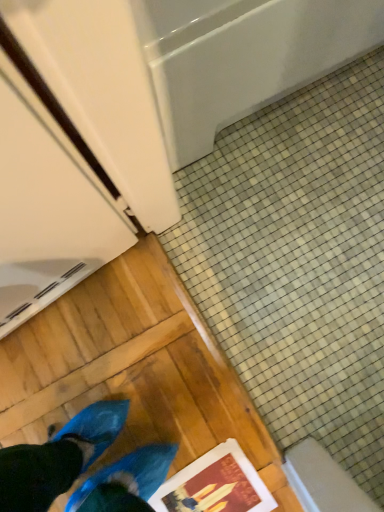
The width and height of the screenshot is (384, 512). In order to click on white glossy bathtub at upper center in this screenshot , I will do `click(242, 57)`.

The width and height of the screenshot is (384, 512). What do you see at coordinates (242, 57) in the screenshot?
I see `white glossy bathtub at upper center` at bounding box center [242, 57].

I want to click on white glossy bathtub at upper center, so click(x=242, y=57).